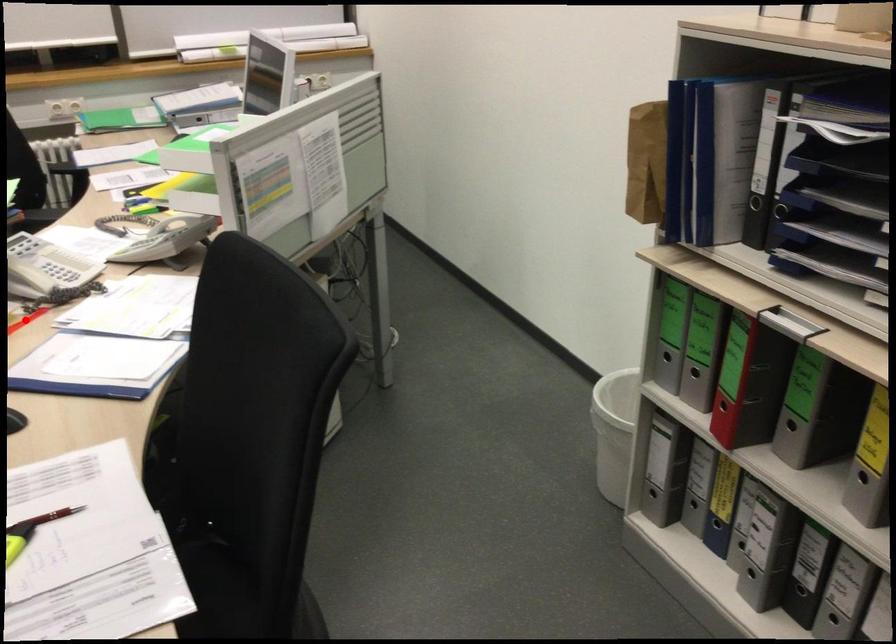
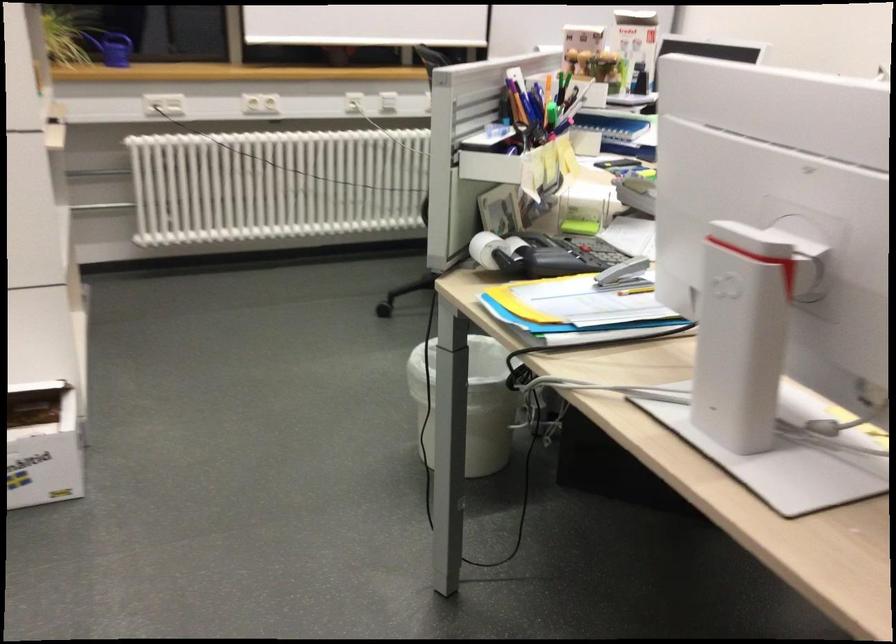
Question: I am providing you with two images of the same scene from different viewpoints. A red point is marked on the first image. At the location where the point appears in image 1, is it still visible in image 2?

Choices:
 (A) Yes
 (B) No

Answer: (B)